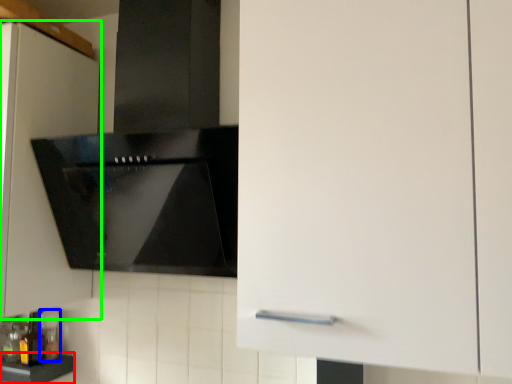
Question: Which object is the farthest from counter top (highlighted by a red box)? Choose among these: bottle (highlighted by a blue box) or cabinetry (highlighted by a green box).

Choices:
 (A) bottle
 (B) cabinetry

Answer: (B)